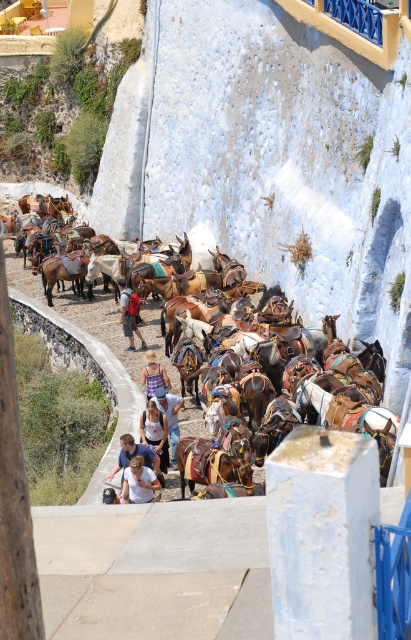
From the picture: You are a photographer trying to capture a photo of the light blue denim shirt at center and the red backpack at center. If you want to ensure both are fully visible in your shot, which object should you focus on to avoid cropping?

You should focus on the red backpack at center because it is wider than the light blue denim shirt at center, so ensuring it fits will also accommodate the smaller shirt.

You are standing at the starting point of the pathway and want to reach a specific point marked as point [126,493]. The path is 50 meters long. Can you walk straight to the point without deviating?

The distance of point [126,493] from viewer is 53.55 meters. Since the path is only 50 meters long, you cannot reach the point by walking straight as it is beyond the path length.